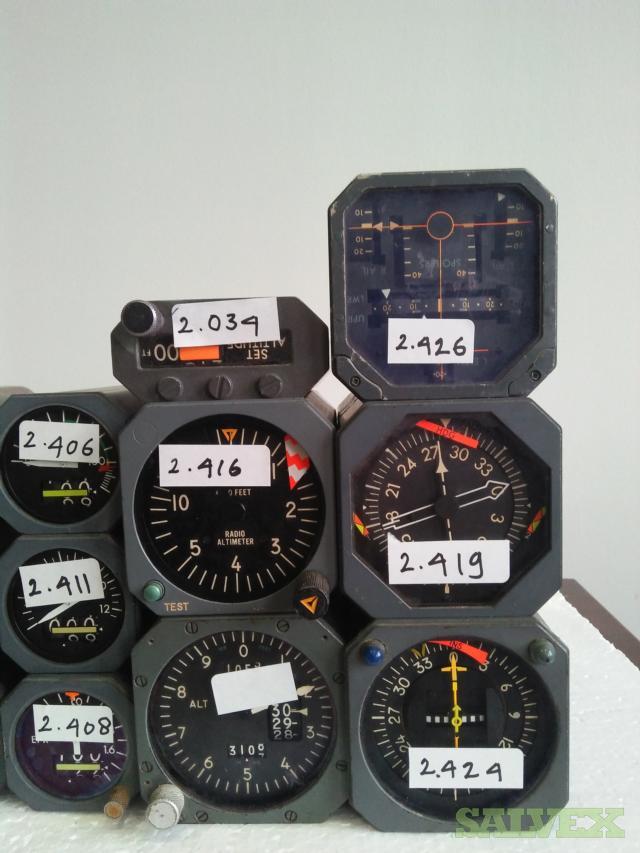
At what (x,y) coordinates should I click in order to perform the action: click on white wall. Please return your answer as a coordinate pair (x, y). Looking at the image, I should click on (600, 529).